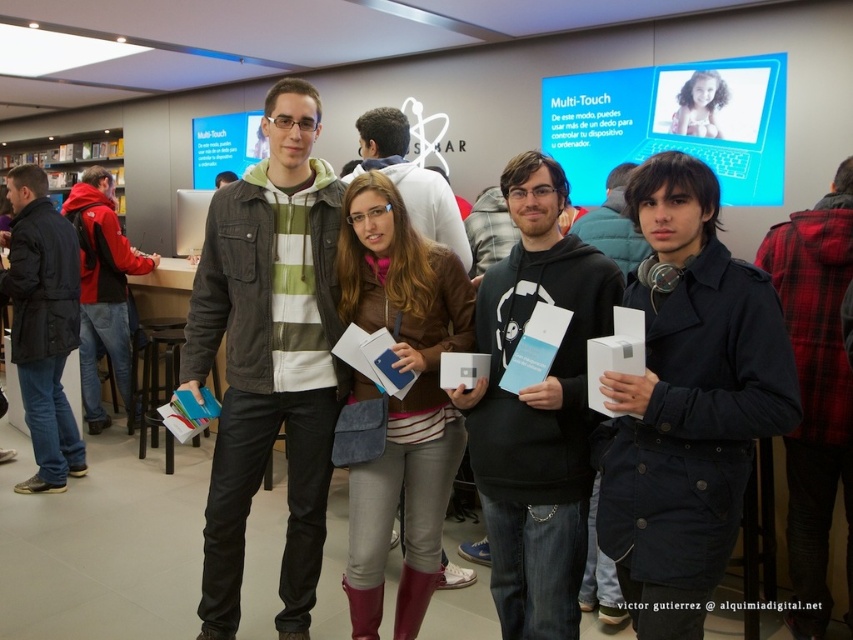
Is red plaid jacket at center thinner than matte brown jacket at center?

Correct, red plaid jacket at center's width is less than matte brown jacket at center's.

Is point (810, 273) behind point (369, 156)?

No.

Is point (799, 557) in front of point (405, 152)?

Yes, point (799, 557) is closer to viewer.

The width and height of the screenshot is (853, 640). I want to click on red plaid jacket at center, so pos(815,392).

Between blue glossy poster at upper center and red plaid jacket at center, which one appears on the left side from the viewer's perspective?

From the viewer's perspective, red plaid jacket at center appears more on the left side.

In order to click on blue glossy poster at upper center in this screenshot , I will do `click(672, 122)`.

Between point (654, 108) and point (828, 417), which one is positioned behind?

The point (654, 108) is behind.

Identify the location of blue glossy poster at upper center. (672, 122).

Consider the image. Can you confirm if dark gray corduroy jacket at center is positioned to the right of matte black jacket at center?

Correct, you'll find dark gray corduroy jacket at center to the right of matte black jacket at center.

Is point (285, 396) closer to camera compared to point (148, 262)?

That is True.

Where is `dark gray corduroy jacket at center`? dark gray corduroy jacket at center is located at coordinates point(270,356).